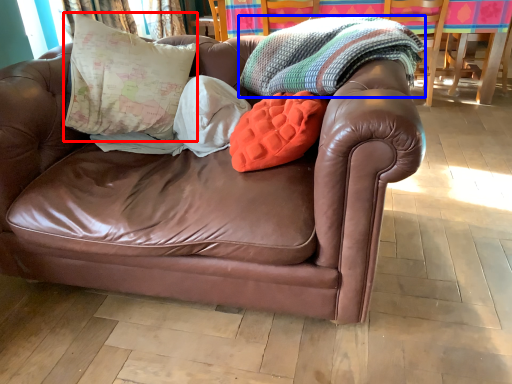
Question: Which point is closer to the camera, pillow (highlighted by a red box) or blanket (highlighted by a blue box)?

Choices:
 (A) pillow
 (B) blanket

Answer: (B)